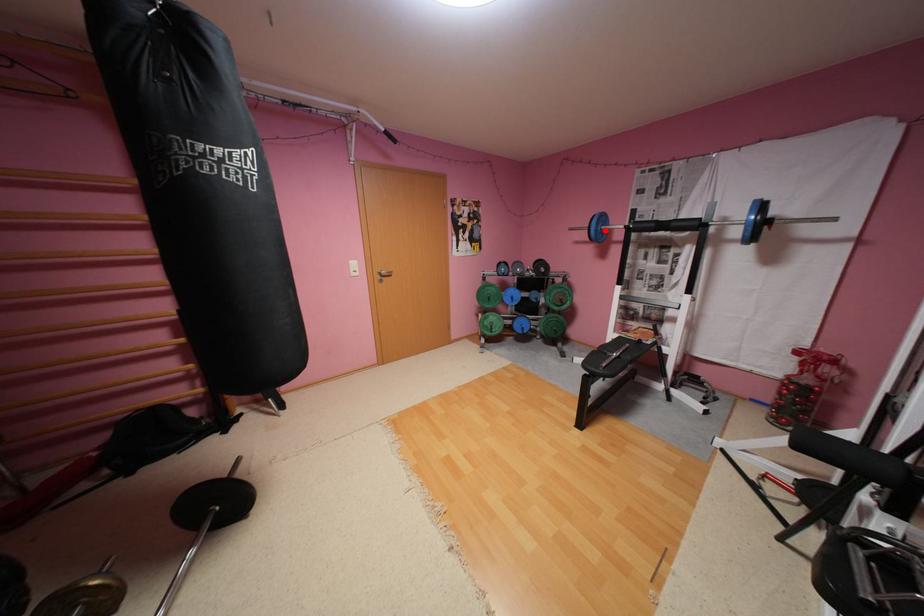
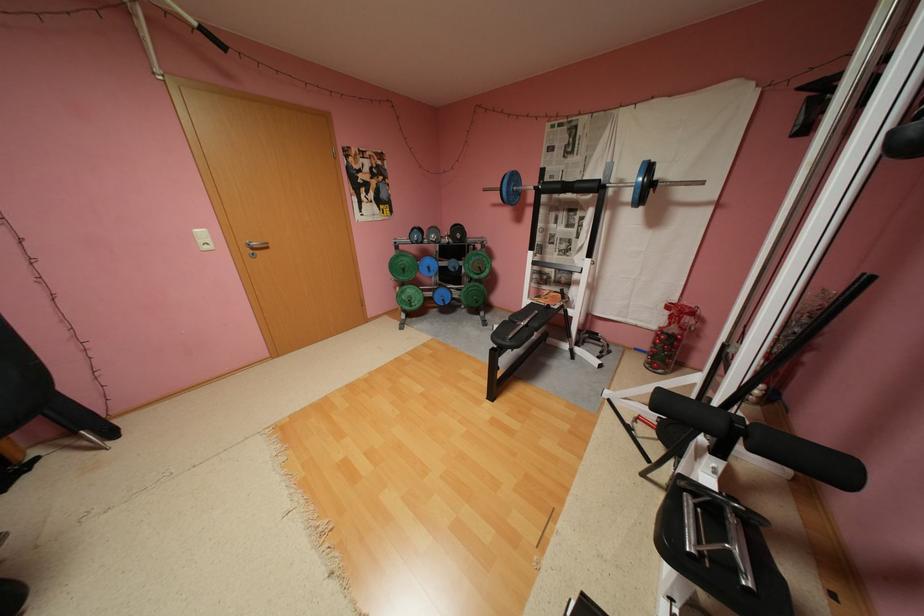
Question: I am providing you with two images of the same scene from different viewpoints. A red point is shown in image1. For the corresponding object point in image2, is it positioned nearer or farther from the camera?

Choices:
 (A) Nearer
 (B) Farther

Answer: (A)